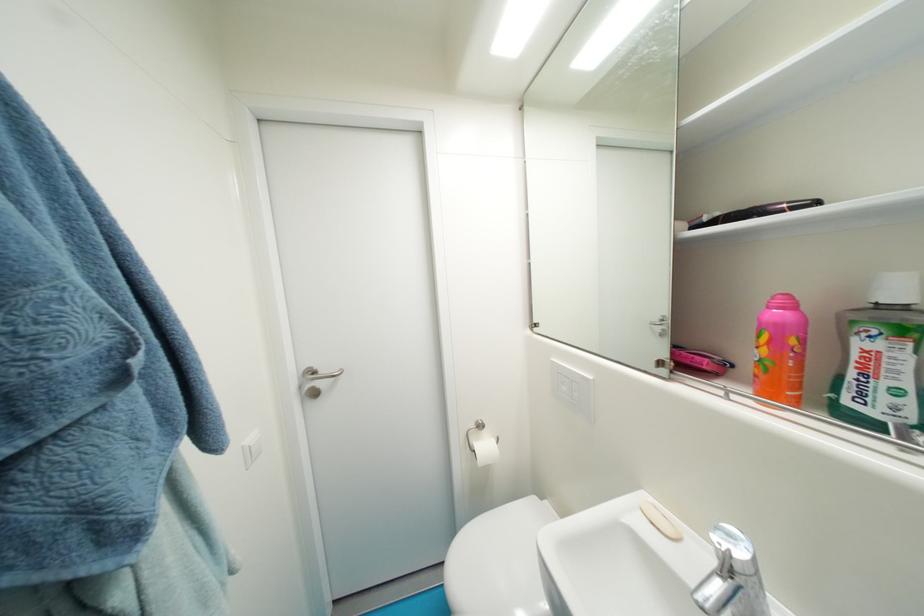
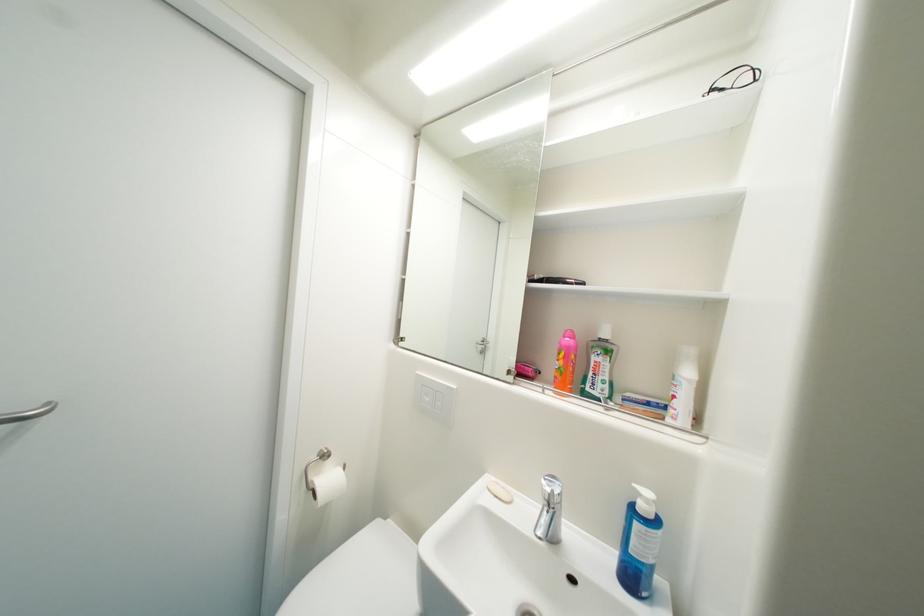
The point at (659, 525) is marked in the first image. Where is the corresponding point in the second image?

(503, 498)